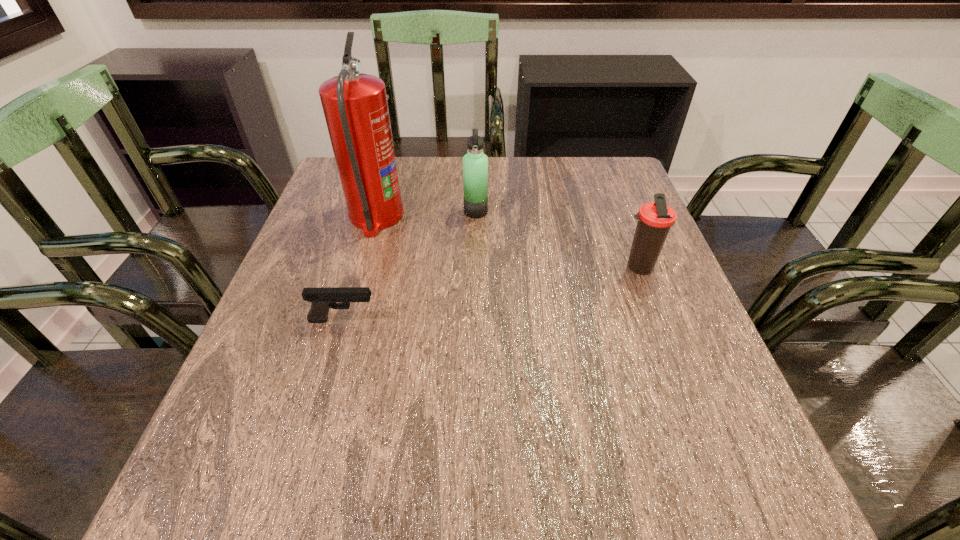
What are the coordinates of `free spot between the shortest object and the fire extinguisher` in the screenshot? It's located at (359, 268).

The width and height of the screenshot is (960, 540). I want to click on the third closest object to the fire extinguisher, so click(x=655, y=219).

Locate an element on the screen. Image resolution: width=960 pixels, height=540 pixels. the second closest object to the fire extinguisher is located at coordinates tap(322, 299).

Where is `vacant region that satisfies the following two spatial constraints: 1. on the front side of the farther thermos bottle; 2. on the front-facing side of the nearest object`? Image resolution: width=960 pixels, height=540 pixels. vacant region that satisfies the following two spatial constraints: 1. on the front side of the farther thermos bottle; 2. on the front-facing side of the nearest object is located at coordinates (474, 320).

At what (x,y) coordinates should I click in order to perform the action: click on vacant space that satisfies the following two spatial constraints: 1. on the back side of the rightmost object; 2. on the instruction side of the fire extinguisher. Please return your answer as a coordinate pair (x, y). The height and width of the screenshot is (540, 960). Looking at the image, I should click on (619, 217).

The width and height of the screenshot is (960, 540). I want to click on free space that satisfies the following two spatial constraints: 1. on the front side of the shorter thermos bottle; 2. on the front-facing side of the shortest object, so pyautogui.click(x=659, y=320).